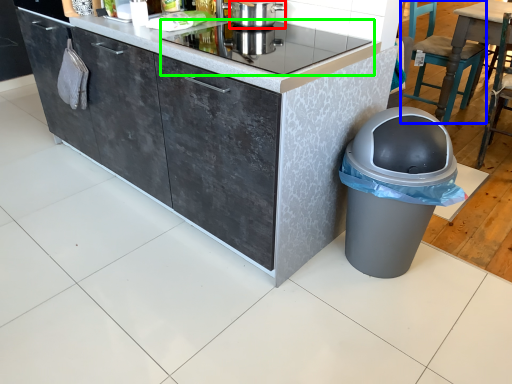
Question: Based on their relative distances, which object is farther from kitchen appliance (highlighted by a red box)? Choose from chair (highlighted by a blue box) and home appliance (highlighted by a green box).

Choices:
 (A) chair
 (B) home appliance

Answer: (A)